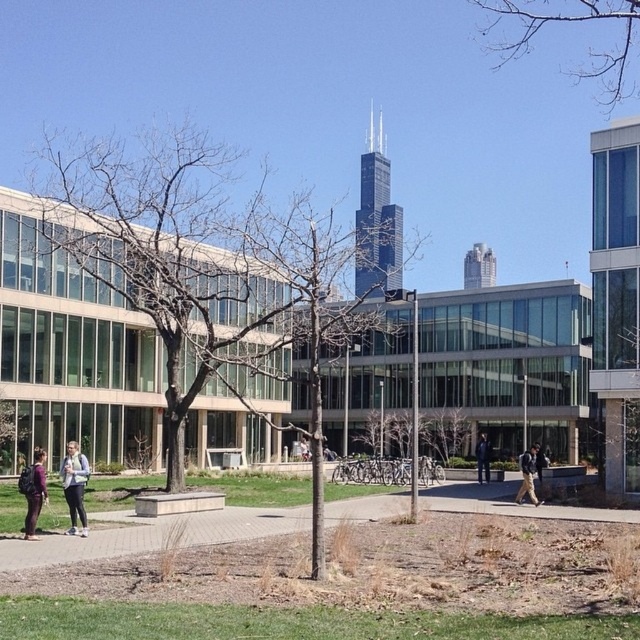
You are standing on the grassy area in the foreground of the image and want to approach the modern building complex. Which object, the matte purple jacket at lower left or the khaki pants at center, would you encounter first while moving towards the building?

The matte purple jacket at lower left is closer to the viewer than the khaki pants at center, so you would encounter the matte purple jacket at lower left first while moving towards the building.